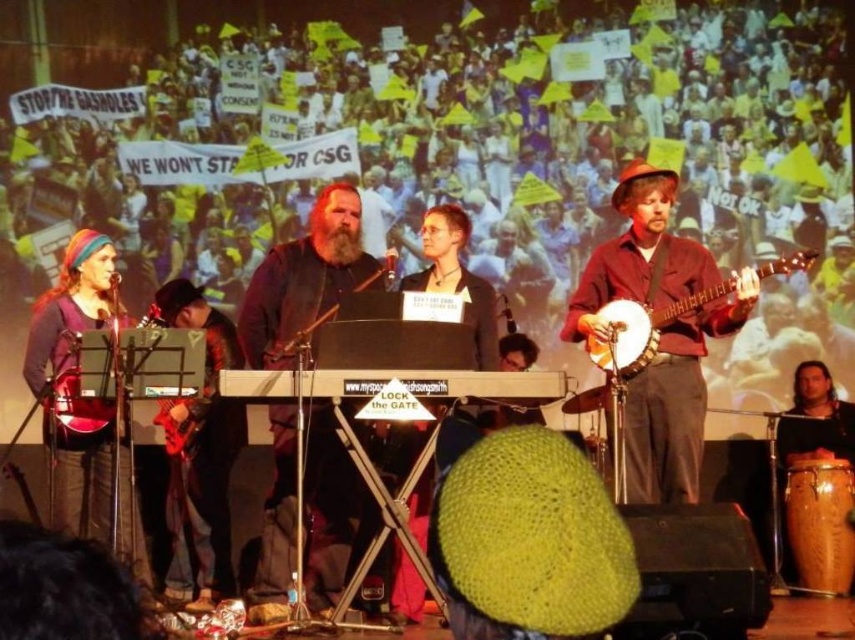
Question: Which point is farther to the camera?

Choices:
 (A) black keyboard at center
 (B) multicolored fabric headband at left

Answer: (B)

Question: Which point is farther from the camera taking this photo?

Choices:
 (A) (321, 317)
 (B) (214, 340)
 (C) (81, 448)
 (D) (617, 332)

Answer: (B)

Question: Is shiny black guitar at lower left positioned in front of metallic red drum at left?

Choices:
 (A) yes
 (B) no

Answer: (B)

Question: Among these objects, which one is farthest from the camera?

Choices:
 (A) shiny black guitar at lower left
 (B) multicolored fabric headband at left

Answer: (A)

Question: Is brown leather hat at upper right thinner than metallic red drum at left?

Choices:
 (A) yes
 (B) no

Answer: (B)

Question: Does brown leather hat at upper right have a lesser width compared to black keyboard at center?

Choices:
 (A) no
 (B) yes

Answer: (A)